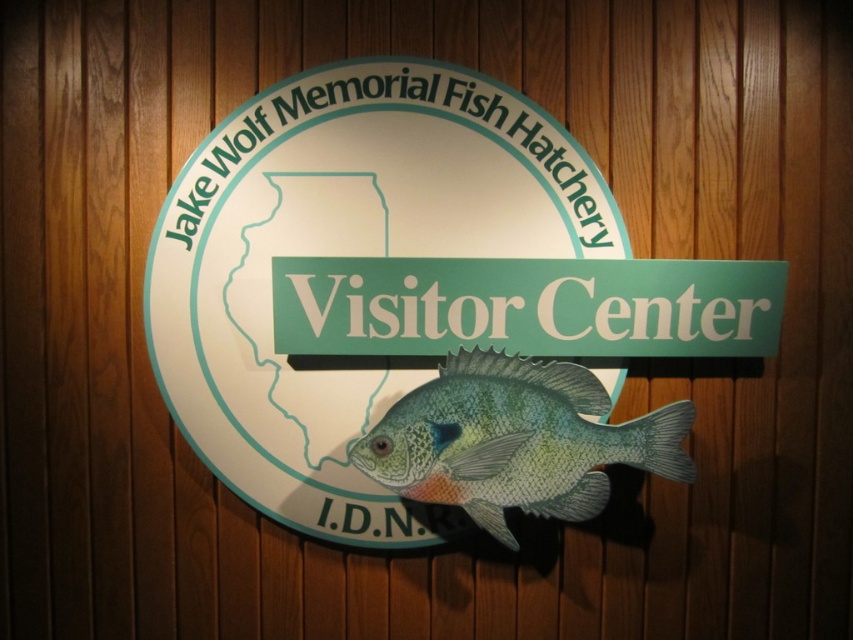
You are a visitor standing 10 feet away from the signboard. You want to touch both the matte plastic sign at center and the shiny blue fish at center with a single straight motion of your outstretched hand without moving your body. Is this possible?

The distance between the matte plastic sign at center and the shiny blue fish at center is 7.50 inches. Since your outstretched hand can cover this distance easily while remaining stationary, you can indeed touch both objects with a single straight motion.

You are standing in front of the signboard and want to touch both points mentioned. Which point should you reach for first, the point at coordinate [408,76] or the point at coordinate [492,365]?

You should reach for the point at coordinate [408,76] first because it is closer to you than the point at coordinate [492,365].

You are a visitor approaching the signboard. You want to touch the shiny blue fish at center. Can you reach it without moving the matte plastic sign at center?

The shiny blue fish at center is behind the matte plastic sign at center, so you cannot reach it without moving the matte plastic sign at center.